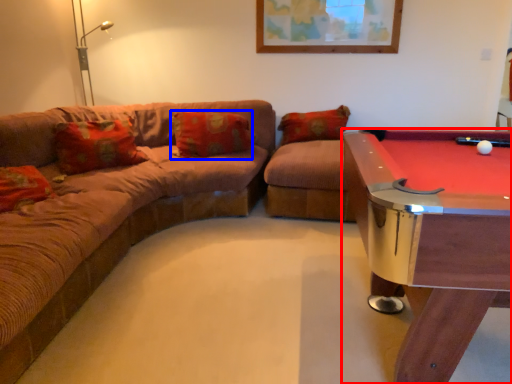
Question: Among these objects, which one is nearest to the camera, billiard table (highlighted by a red box) or pillow (highlighted by a blue box)?

Choices:
 (A) billiard table
 (B) pillow

Answer: (A)